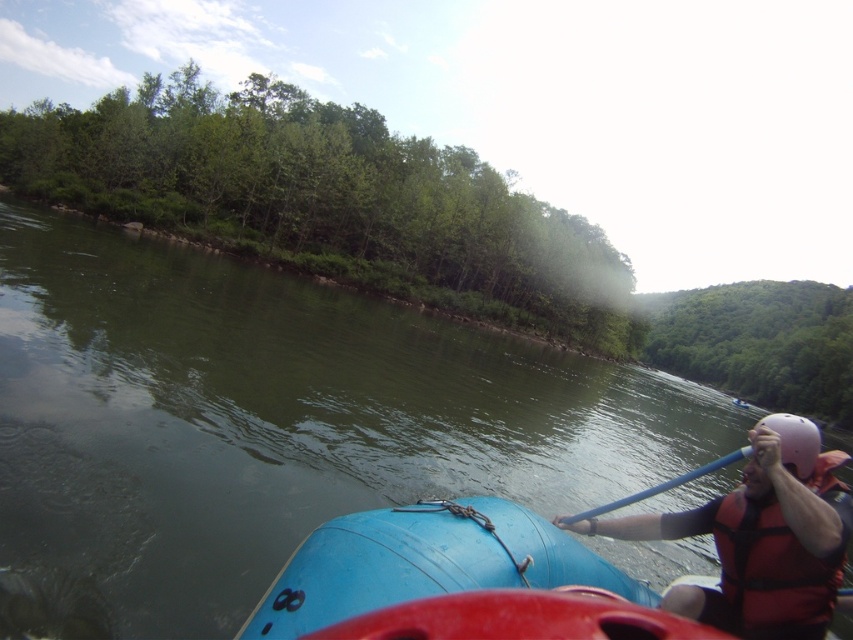
Can you confirm if red/black life jacket at right is positioned above peach matte helmet at right?

Yes.

This screenshot has width=853, height=640. What are the coordinates of `red/black life jacket at right` in the screenshot? It's located at (770, 572).

Is red life vest at right closer to the viewer compared to peach matte helmet at right?

Yes, it is in front of peach matte helmet at right.

Is point (793, 449) more distant than point (798, 465)?

Yes, point (793, 449) is behind point (798, 465).

You are a GUI agent. You are given a task and a screenshot of the screen. Output one action in this format:
    pyautogui.click(x=<x>, y=<y>)
    Task: Click on the red life vest at right
    The image size is (853, 640).
    Given the screenshot: What is the action you would take?
    tap(761, 538)

Who is higher up, green leafy trees at upper left or red life vest at right?

green leafy trees at upper left

Does green leafy trees at upper left appear on the right side of red life vest at right?

No, green leafy trees at upper left is not to the right of red life vest at right.

Between point (206, 93) and point (746, 609), which one is positioned behind?

The point (206, 93) is behind.

Where is `green leafy trees at upper left`? green leafy trees at upper left is located at coordinates (328, 200).